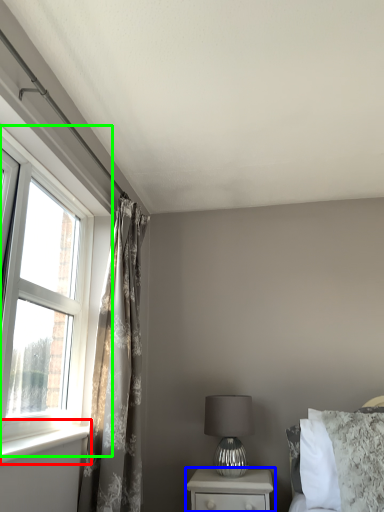
Question: Which is nearer to the window sill (highlighted by a red box)? nightstand (highlighted by a blue box) or window (highlighted by a green box).

Choices:
 (A) nightstand
 (B) window

Answer: (B)